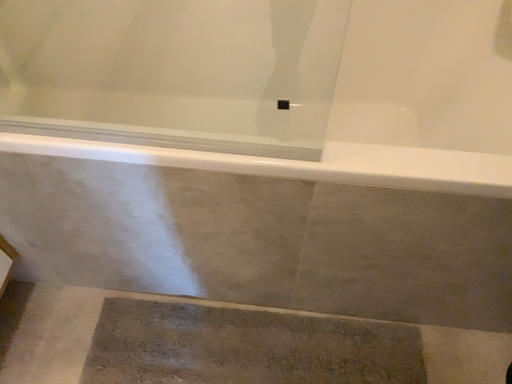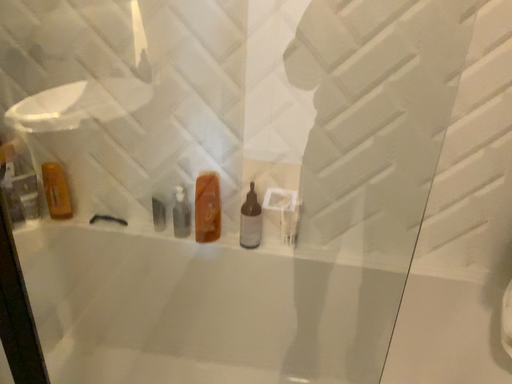
Question: Which way did the camera rotate in the video?

Choices:
 (A) rotated downward
 (B) rotated upward

Answer: (B)